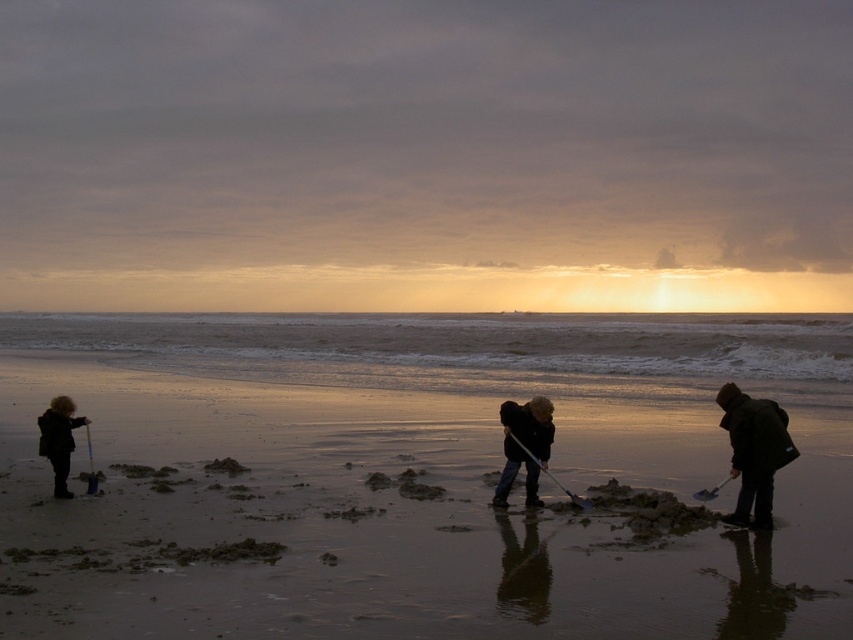
Looking at this image, you are a photographer trying to capture the three shovels in the scene. You notice two metallic silver shovels. Which shovel, the metallic silver shovel at center or the metallic silver shovel at lower right, is closer to the camera?

The metallic silver shovel at center is closer to the camera because the metallic silver shovel at lower right is behind it.

You are standing at the beach and want to reach the point marked as point (45, 456). If you walk straight ahead, will you reach that point before the water gets too deep?

The point (45, 456) is 11.24 meters from the camera. Since the beach is wet and the water reflection is present, walking 11.24 meters straight might lead you into deeper water, but the exact depth depends on the tide and slope. However, the question only asks if you can reach the point before the water gets too deep. Since the distance is measurable and the point exists on the beach, you can reach it before the water becomes too deep as it is a marked point on the beach.

You are a photographer trying to capture the metallic silver shovel at lower right in the frame. However, the dark brown wool coat at left is blocking your view. Can you move the shovel to the front so it appears in front of the coat?

The metallic silver shovel at lower right is currently behind the dark brown wool coat at left, so moving it to the front would allow it to appear in front of the coat.